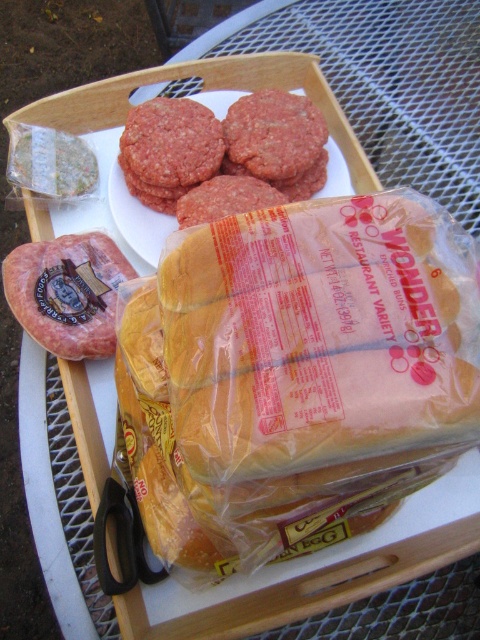
Can you confirm if ground beef patty at center is positioned below smooth pinkish-red meat at center-left?

No.

Does point (297, 189) lie behind point (95, 349)?

Yes, it is behind point (95, 349).

The width and height of the screenshot is (480, 640). Find the location of `ground beef patty at center`. ground beef patty at center is located at coordinates (223, 154).

What are the coordinates of `ground beef patty at center` in the screenshot? It's located at (223, 154).

Is point (294, 506) positioned after point (305, 177)?

No, it is in front of (305, 177).

Who is lower down, yellow soft bread at center or ground beef patty at center?

yellow soft bread at center is below.

Image resolution: width=480 pixels, height=640 pixels. What do you see at coordinates (299, 371) in the screenshot? I see `yellow soft bread at center` at bounding box center [299, 371].

At what (x,y) coordinates should I click in order to perform the action: click on yellow soft bread at center. Please return your answer as a coordinate pair (x, y). The image size is (480, 640). Looking at the image, I should click on (299, 371).

Where is `yellow soft bread at center`? Image resolution: width=480 pixels, height=640 pixels. yellow soft bread at center is located at coordinates (299, 371).

Which is above, yellow soft bread at center or smooth pinkish-red meat at center-left?

smooth pinkish-red meat at center-left is higher up.

Which is behind, point (304, 262) or point (90, 234)?

The point (90, 234) is behind.

Locate an element on the screen. yellow soft bread at center is located at coordinates (299, 371).